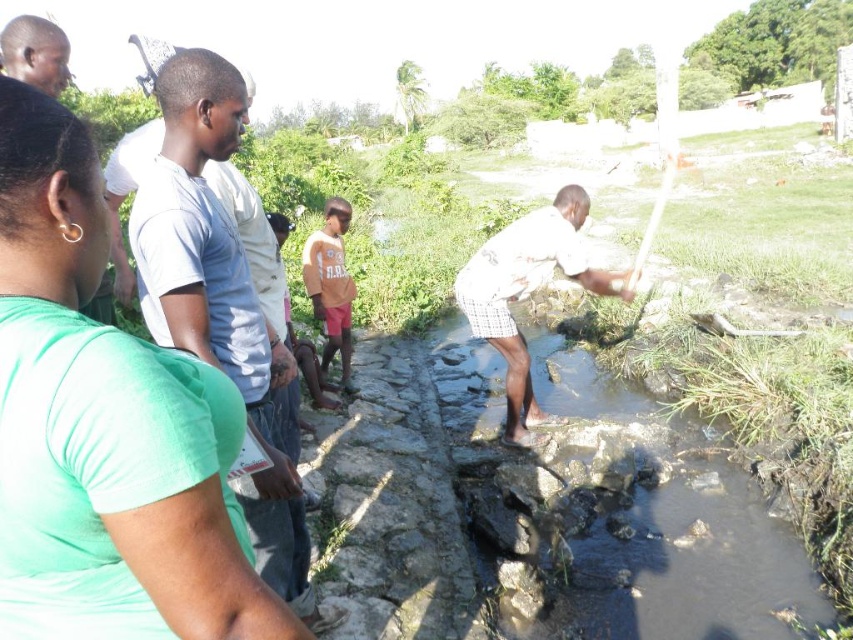
Is the position of brown fabric shorts at center less distant than that of matte black shirt at upper left?

That is False.

I want to click on brown fabric shorts at center, so click(329, 285).

Between point (309, 296) and point (44, 88), which one is positioned behind?

Positioned behind is point (309, 296).

Locate an element on the screen. The image size is (853, 640). brown fabric shorts at center is located at coordinates (329, 285).

Between white checkered shorts at center and matte black shirt at upper left, which one appears on the right side from the viewer's perspective?

From the viewer's perspective, white checkered shorts at center appears more on the right side.

Is point (596, 280) behind point (67, 58)?

Yes, it is behind point (67, 58).

Locate an element on the screen. The height and width of the screenshot is (640, 853). white checkered shorts at center is located at coordinates (527, 291).

Between green matte shirt at left and matte black shirt at upper left, which one has less height?

With less height is green matte shirt at left.

Between point (68, 253) and point (6, 72), which one is positioned behind?

Point (6, 72)

In order to click on green matte shirt at left in this screenshot , I will do `click(103, 429)`.